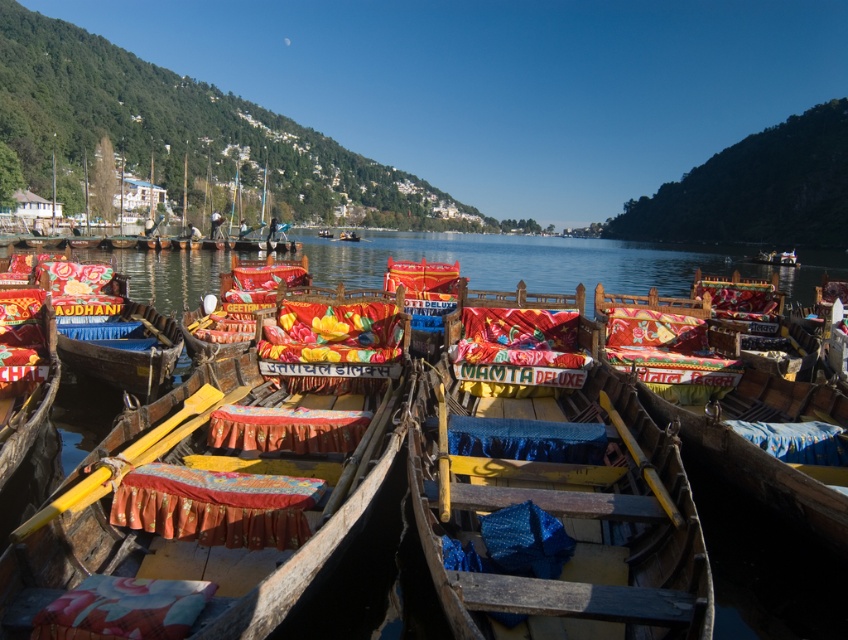
You are planning to launch a small toy boat into the lake. Based on the scene, which object would require more space to accommodate your toy boat, the matte wooden boat at center or the transparent water at center?

The transparent water at center occupies more space than the matte wooden boat at center, so the toy boat would require more space to accommodate in the transparent water at center.